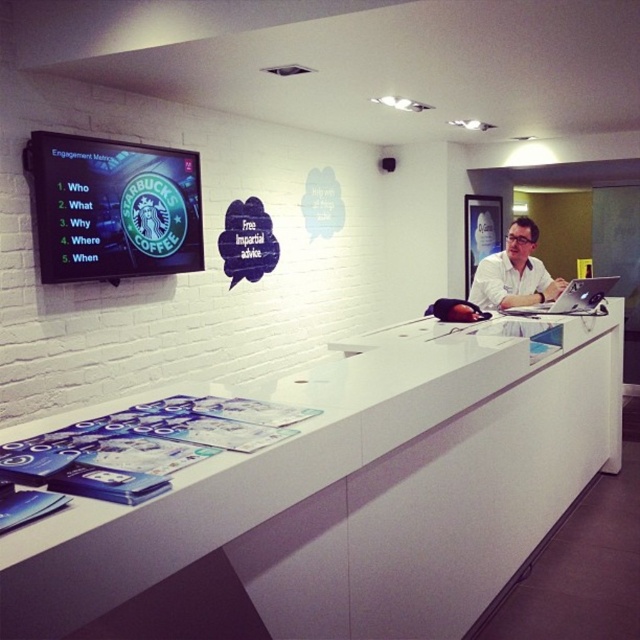
Question: Estimate the real-world distances between objects in this image. Which object is farther from the sleek silver laptop at center?

Choices:
 (A) white smooth shirt at center
 (B) white glossy counter at center

Answer: (B)

Question: Which of these objects is positioned farthest from the white smooth shirt at center?

Choices:
 (A) white glossy counter at center
 (B) sleek silver laptop at center

Answer: (A)

Question: Is white glossy counter at center to the right of white smooth shirt at center from the viewer's perspective?

Choices:
 (A) yes
 (B) no

Answer: (B)

Question: Which point is closer to the camera?

Choices:
 (A) white smooth shirt at center
 (B) white glossy counter at center
 (C) sleek silver laptop at center

Answer: (B)

Question: Is the position of white glossy counter at center more distant than that of sleek silver laptop at center?

Choices:
 (A) yes
 (B) no

Answer: (B)

Question: Does white glossy counter at center come in front of white smooth shirt at center?

Choices:
 (A) no
 (B) yes

Answer: (B)